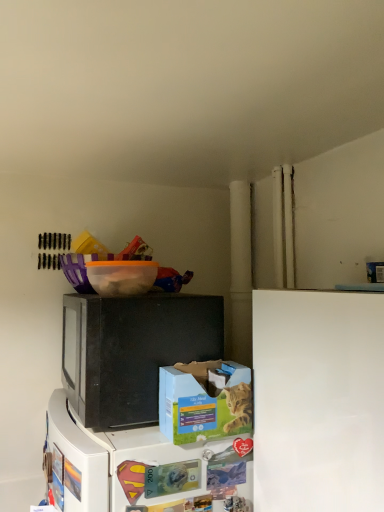
Question: Is white matte refrigerator at lower right wider than orange translucent bowl at upper center?

Choices:
 (A) no
 (B) yes

Answer: (B)

Question: From a real-world perspective, is white matte refrigerator at lower right physically above orange translucent bowl at upper center?

Choices:
 (A) yes
 (B) no

Answer: (B)

Question: Is orange translucent bowl at upper center completely or partially inside white matte refrigerator at lower right?

Choices:
 (A) no
 (B) yes

Answer: (A)

Question: Is white matte refrigerator at lower right bigger than orange translucent bowl at upper center?

Choices:
 (A) no
 (B) yes

Answer: (B)

Question: Does white matte refrigerator at lower right have a smaller size compared to orange translucent bowl at upper center?

Choices:
 (A) yes
 (B) no

Answer: (B)

Question: Looking at the image, does white matte refrigerator at lower right seem bigger or smaller compared to blue cardboard box at lower center?

Choices:
 (A) small
 (B) big

Answer: (B)

Question: In terms of height, does white matte refrigerator at lower right look taller or shorter compared to blue cardboard box at lower center?

Choices:
 (A) tall
 (B) short

Answer: (A)

Question: From a real-world perspective, is white matte refrigerator at lower right above or below blue cardboard box at lower center?

Choices:
 (A) below
 (B) above

Answer: (A)

Question: Does point (354, 385) appear closer or farther from the camera than point (203, 428)?

Choices:
 (A) closer
 (B) farther

Answer: (A)

Question: From the image's perspective, relative to black matte microwave at center, is blue cardboard box at lower center above or below?

Choices:
 (A) above
 (B) below

Answer: (B)

Question: In terms of size, does blue cardboard box at lower center appear bigger or smaller than black matte microwave at center?

Choices:
 (A) big
 (B) small

Answer: (B)

Question: Is blue cardboard box at lower center in front of or behind black matte microwave at center in the image?

Choices:
 (A) behind
 (B) front

Answer: (B)

Question: From their relative heights in the image, would you say blue cardboard box at lower center is taller or shorter than black matte microwave at center?

Choices:
 (A) short
 (B) tall

Answer: (A)

Question: Is black matte microwave at center spatially inside orange translucent bowl at upper center, or outside of it?

Choices:
 (A) outside
 (B) inside

Answer: (A)

Question: Is black matte microwave at center to the left or to the right of orange translucent bowl at upper center in the image?

Choices:
 (A) right
 (B) left

Answer: (A)